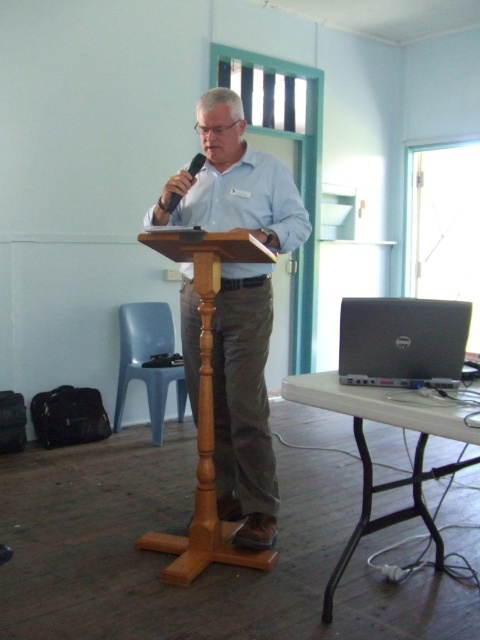
Question: Where is light blue shirt at center located in relation to black matte microphone at center in the image?

Choices:
 (A) right
 (B) left

Answer: (A)

Question: Which object is closer to the camera taking this photo?

Choices:
 (A) dell laptop at right
 (B) light blue cotton shirt at center
 (C) light blue shirt at center
 (D) black matte microphone at center

Answer: (A)

Question: Can you confirm if dell laptop at right is positioned above light blue cotton shirt at center?

Choices:
 (A) yes
 (B) no

Answer: (B)

Question: Can you confirm if light blue shirt at center is wider than black matte microphone at center?

Choices:
 (A) no
 (B) yes

Answer: (B)

Question: Which object is positioned closest to the light blue cotton shirt at center?

Choices:
 (A) dell laptop at right
 (B) light blue shirt at center
 (C) black matte microphone at center

Answer: (B)

Question: Which point is closer to the camera?

Choices:
 (A) light blue cotton shirt at center
 (B) dell laptop at right

Answer: (B)